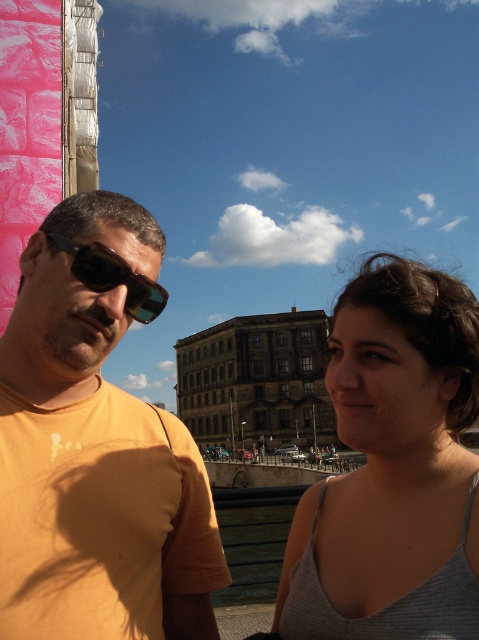
You are standing at the point with coordinates (95, 449) in the image. Which object are you currently on?

The point at (95, 449) is on the matte orange t shirt at left.

You are a photographer trying to capture a photo of the gray fabric tank top at center and the black reflective sunglasses at left in the same frame. Given that your camera has a maximum focus range of 10 meters, will you be able to focus on both objects simultaneously?

The gray fabric tank top at center and the black reflective sunglasses at left are 13.96 meters apart from each other, which exceeds the camera maximum focus range of 10 meters. Therefore, you cannot focus on both objects simultaneously.